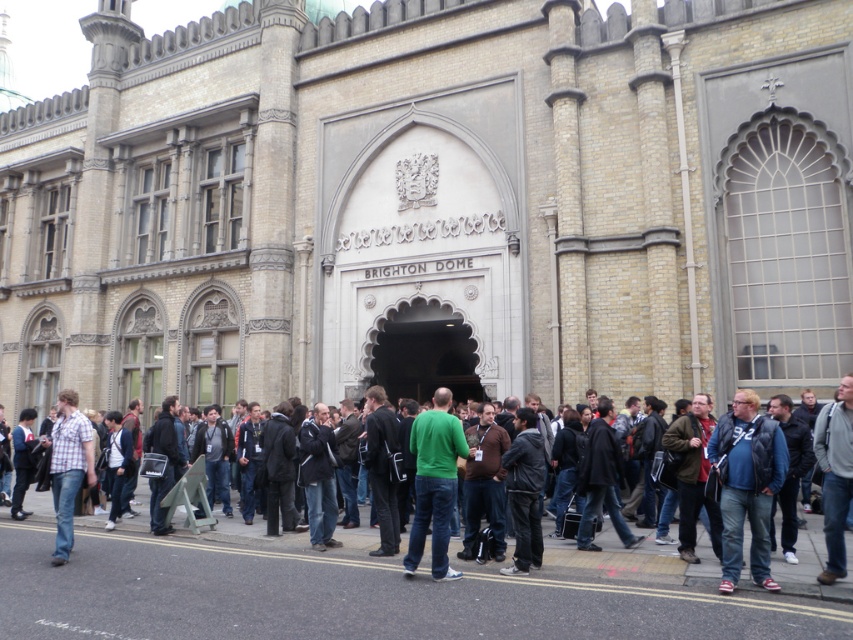
You are a photographer standing in front of the Brighton Dome. You notice two people wearing a matte blue jacket at center and a green matte shirt at center. Which one is positioned to the right?

The matte blue jacket at center is positioned to the right of the green matte shirt at center.

You are a photographer at the Brighton Dome event. You want to capture both the matte blue jacket at center and the plaid shirt at center in a single photo. Which clothing item should you focus on first to ensure both are in frame?

The matte blue jacket at center is shorter than the plaid shirt at center. To ensure both are in frame, focus on the plaid shirt at center first as it is taller and requires more space.

You are standing at the Brighton Dome entrance and want to cross the road. There is a point marked at coordinates (351, 596). According to the image, what is located at this point?

The point at coordinates (351, 596) corresponds to the black asphalt road at lower center.